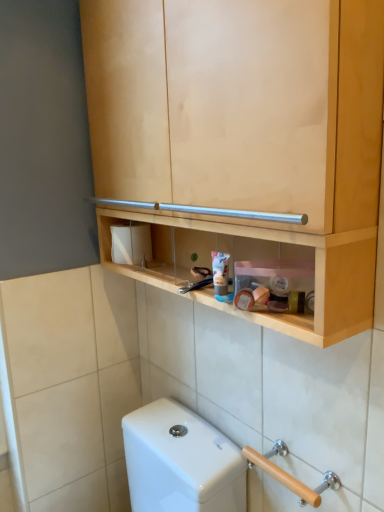
Question: From the image's perspective, is natural wood cabinet at upper center located above or below wooden at lower right?

Choices:
 (A) above
 (B) below

Answer: (A)

Question: Is natural wood cabinet at upper center in front of or behind wooden at lower right in the image?

Choices:
 (A) front
 (B) behind

Answer: (A)

Question: Estimate the real-world distances between objects in this image. Which object is closer to the white matte toilet paper at center?

Choices:
 (A) natural wood cabinet at upper center
 (B) white glossy toothpaste at center
 (C) wooden at lower right

Answer: (B)

Question: Which object is positioned farthest from the white glossy toothpaste at center?

Choices:
 (A) white matte toilet paper at center
 (B) wooden at lower right
 (C) natural wood cabinet at upper center

Answer: (B)